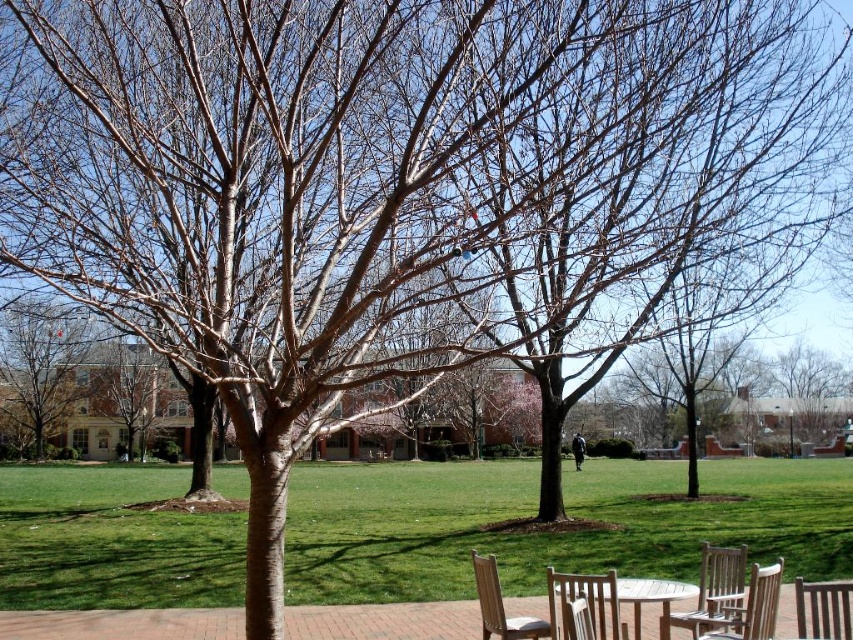
Question: Is the position of light brown wooden chair at lower right less distant than that of brown wooden chair at lower right?

Choices:
 (A) yes
 (B) no

Answer: (B)

Question: Can you confirm if brown bark tree at upper left is bigger than wooden chair at lower right?

Choices:
 (A) yes
 (B) no

Answer: (A)

Question: Observing the image, what is the correct spatial positioning of brown wooden chair at lower right in reference to teak wood chair at lower right?

Choices:
 (A) left
 (B) right

Answer: (B)

Question: Among these points, which one is farthest from the camera?

Choices:
 (A) (41, 449)
 (B) (646, 579)
 (C) (90, 573)
 (D) (753, 618)

Answer: (A)

Question: Among these objects, which one is farthest from the camera?

Choices:
 (A) brown wooden chair at lower right
 (B) teak wood chair at lower center
 (C) light brown wood picnic table at lower center

Answer: (B)

Question: Among these points, which one is farthest from the camera?

Choices:
 (A) (544, 630)
 (B) (730, 576)
 (C) (589, 592)

Answer: (B)